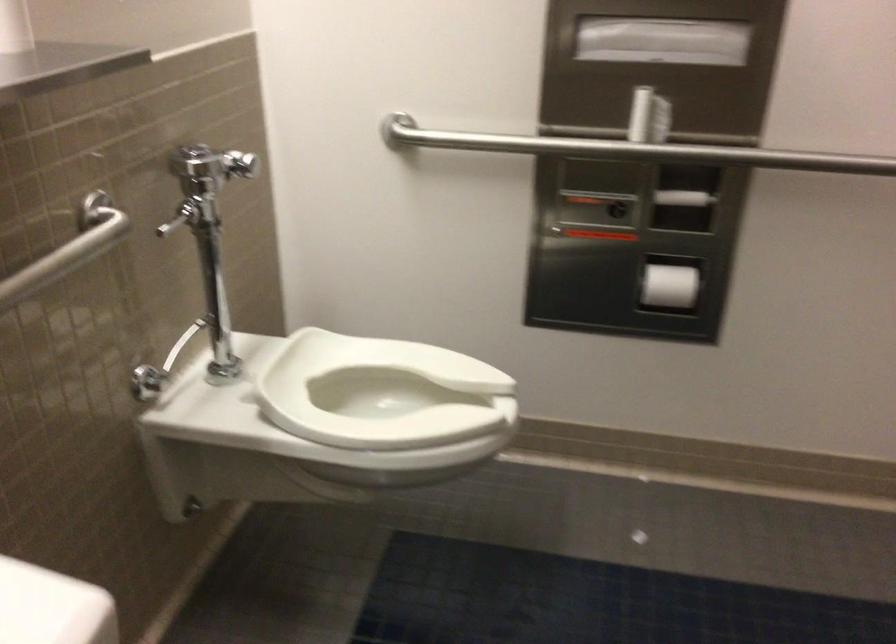
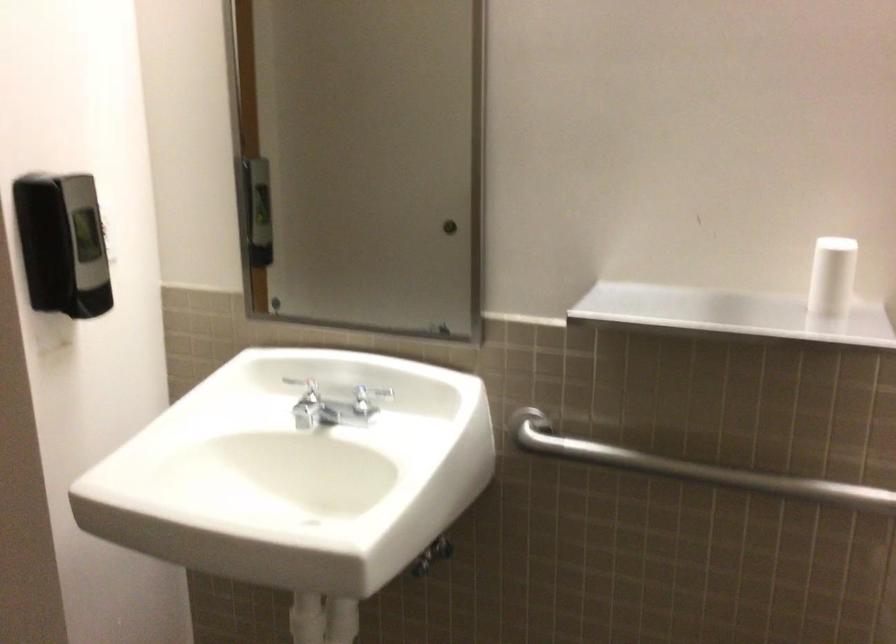
From the picture: How did the camera likely rotate?

The camera's rotation is toward left-down.